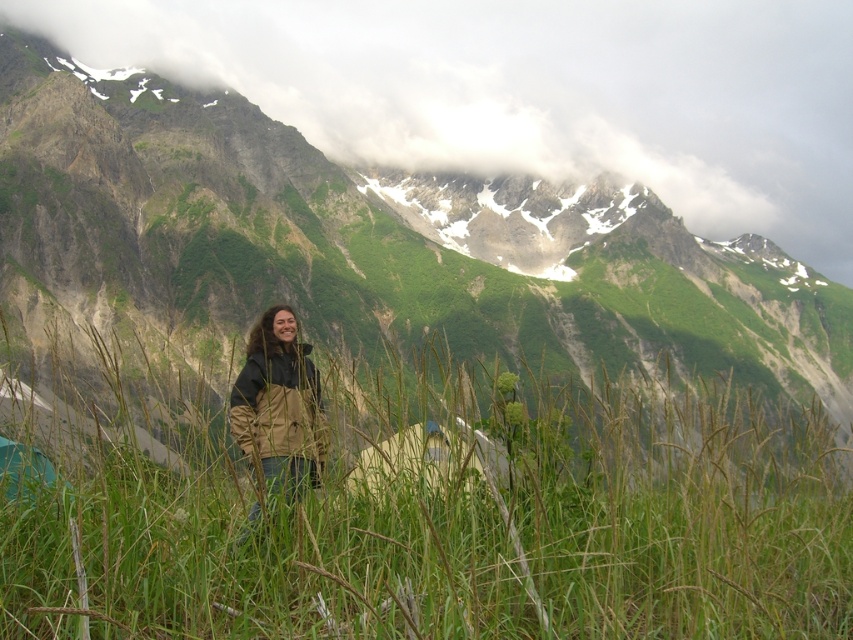
Between green grassy at center and white canvas tent at center, which one appears on the right side from the viewer's perspective?

green grassy at center is more to the right.

Is point (604, 570) more distant than point (363, 451)?

That is False.

The image size is (853, 640). Find the location of `green grassy at center`. green grassy at center is located at coordinates (451, 524).

Does green grassy at center have a lesser height compared to green grassy mountain at center?

Correct, green grassy at center is not as tall as green grassy mountain at center.

Between green grassy at center and green grassy mountain at center, which one has more height?

green grassy mountain at center

Is point (613, 560) positioned behind point (113, 305)?

No, (613, 560) is closer to viewer.

Locate an element on the screen. The image size is (853, 640). green grassy at center is located at coordinates (451, 524).

Does brown/cotton jacket at center have a smaller size compared to green fabric tent at lower left?

Incorrect, brown/cotton jacket at center is not smaller in size than green fabric tent at lower left.

Is brown/cotton jacket at center below green fabric tent at lower left?

Actually, brown/cotton jacket at center is above green fabric tent at lower left.

Which is behind, point (254, 442) or point (12, 483)?

The point (254, 442) is more distant.

Locate an element on the screen. This screenshot has width=853, height=640. brown/cotton jacket at center is located at coordinates (279, 404).